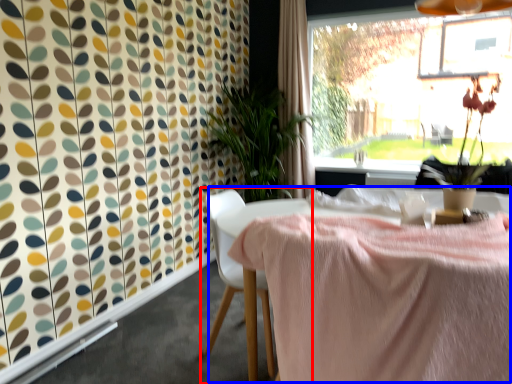
Question: Which of the following is the farthest to the observer, chair (highlighted by a red box) or table (highlighted by a blue box)?

Choices:
 (A) chair
 (B) table

Answer: (A)